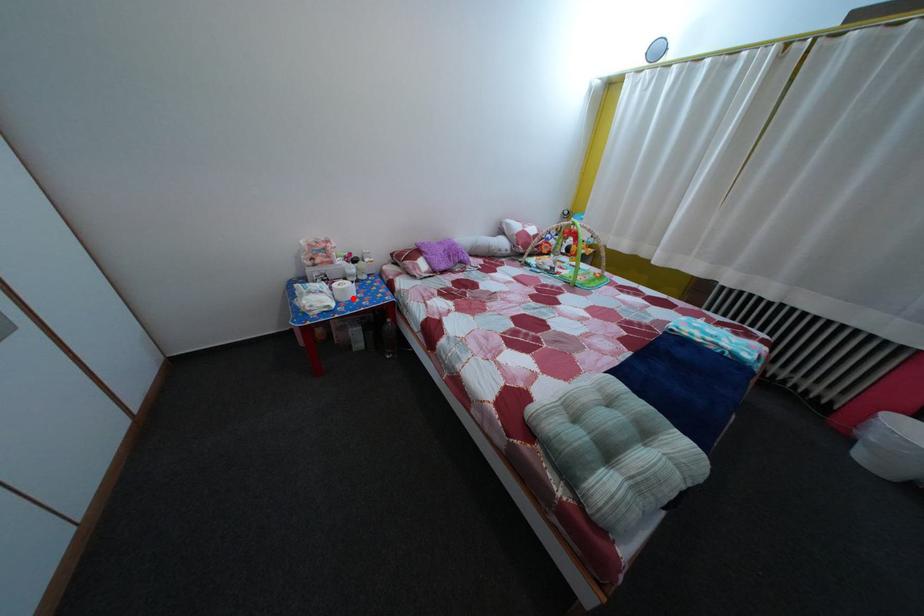
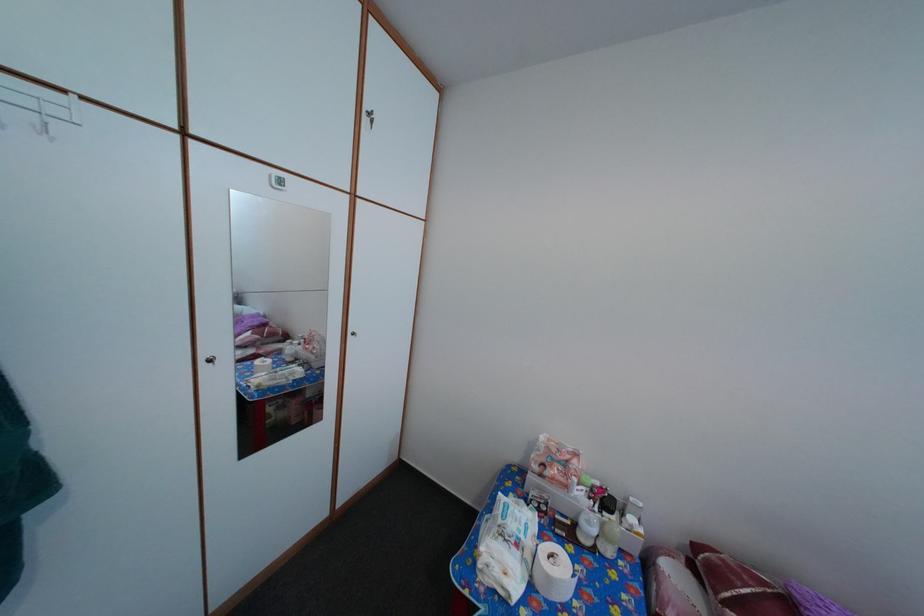
In the second image, find the point that corresponds to the highlighted location in the first image.

(558, 586)